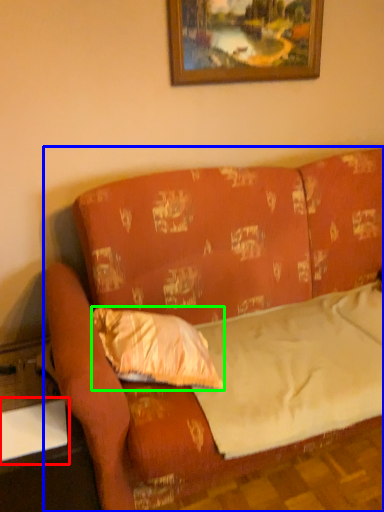
Question: Estimate the real-world distances between objects in this image. Which object is farther from table (highlighted by a red box), studio couch (highlighted by a blue box) or pillow (highlighted by a green box)?

Choices:
 (A) studio couch
 (B) pillow

Answer: (A)